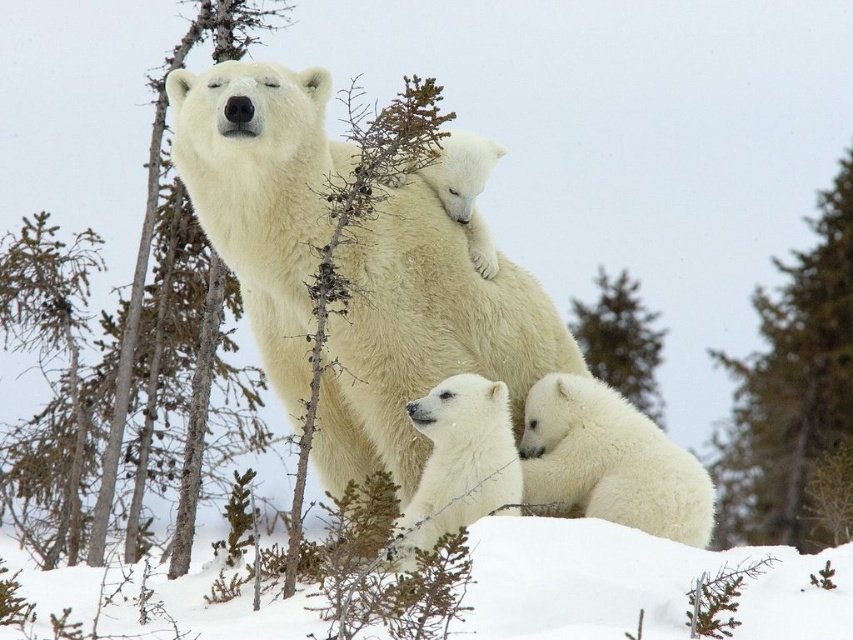
Question: Is green leafy tree at upper right smaller than green fuzzy tree at center?

Choices:
 (A) no
 (B) yes

Answer: (A)

Question: Which is farther from the white fluffy polar bear at lower right?

Choices:
 (A) white fluffy snow at lower center
 (B) white fluffy polar bear at lower center
 (C) green fuzzy tree at center

Answer: (C)

Question: Is white fluffy polar bear at center smaller than green fuzzy tree at center?

Choices:
 (A) yes
 (B) no

Answer: (B)

Question: Is green leafy tree at upper right below white fluffy polar bear at lower right?

Choices:
 (A) yes
 (B) no

Answer: (B)

Question: Which of the following is the farthest from the observer?

Choices:
 (A) green fuzzy tree at center
 (B) green leafy tree at upper right
 (C) white fluffy polar bear at lower right
 (D) white fluffy polar bear at center

Answer: (A)

Question: Considering the real-world distances, which object is closest to the green fuzzy tree at center?

Choices:
 (A) white fluffy polar bear at lower center
 (B) green leafy tree at upper right
 (C) white fluffy polar bear at center

Answer: (B)